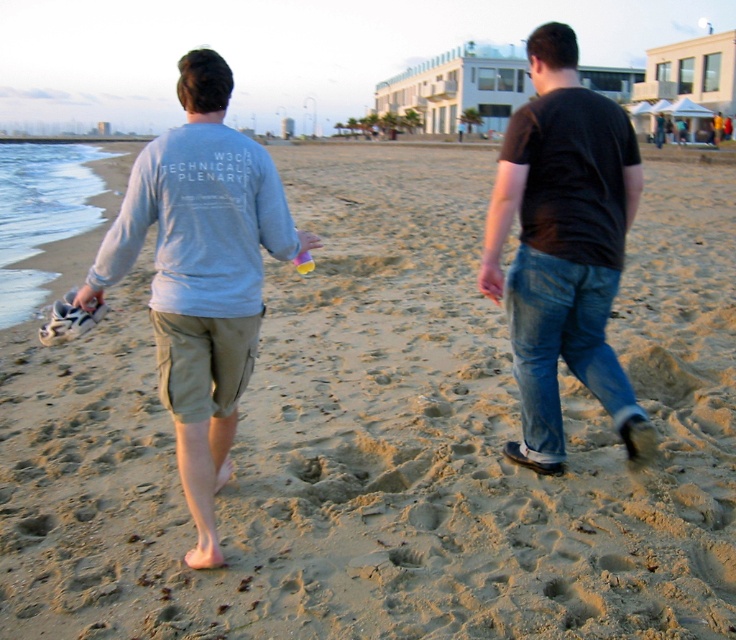
You are standing on the beach and see a point marked at coordinates (201, 273). Which object is this point located on?

The point at coordinates (201, 273) is located on the light gray cotton shirt at left.

You are a photographer trying to capture a group photo of the light gray cotton shirt at left and the black cotton shirt at right. The camera you are using has a minimum focusing distance of 1.5 meters. Can you take the photo without moving either person?

The distance between the light gray cotton shirt at left and the black cotton shirt at right is 1.47 meters. Since the minimum focusing distance is 1.5 meters, the camera cannot focus properly. Therefore, you need to move the subjects slightly farther apart to achieve a clear photo.